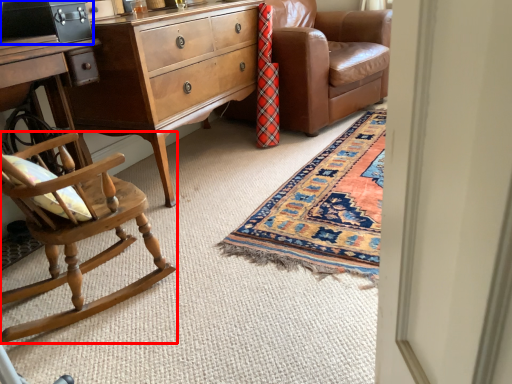
Question: Which object appears farthest to the camera in this image, chair (highlighted by a red box) or cabinetry (highlighted by a blue box)?

Choices:
 (A) chair
 (B) cabinetry

Answer: (B)